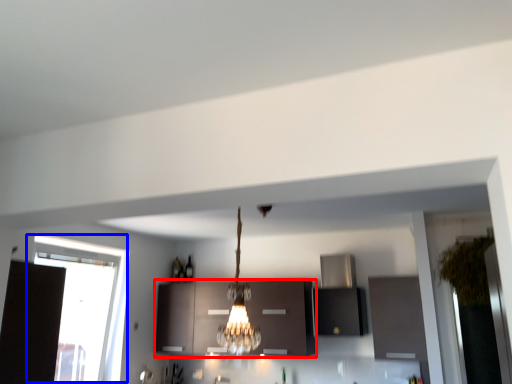
Question: Which of the following is the farthest to the observer, cabinetry (highlighted by a red box) or window (highlighted by a blue box)?

Choices:
 (A) cabinetry
 (B) window

Answer: (A)